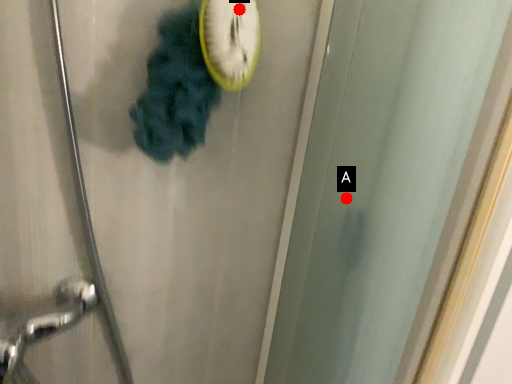
Question: Two points are circled on the image, labeled by A and B beside each circle. Which point is farther from the camera taking this photo?

Choices:
 (A) A is further
 (B) B is further

Answer: (A)